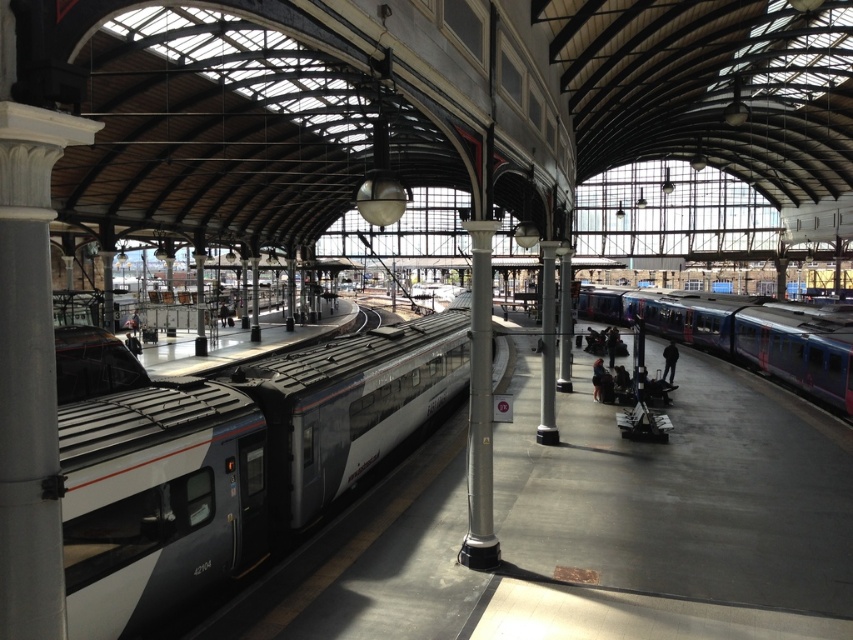
Does metallic blue train at right appear on the left side of dark blue jacket at center?

Incorrect, metallic blue train at right is not on the left side of dark blue jacket at center.

Which is in front, point (805, 353) or point (602, 376)?

Point (602, 376) is in front.

The height and width of the screenshot is (640, 853). What do you see at coordinates (747, 336) in the screenshot?
I see `metallic blue train at right` at bounding box center [747, 336].

What are the coordinates of `metallic blue train at right` in the screenshot? It's located at (747, 336).

Is silver metallic train at left thinner than dark blue jeans at center?

In fact, silver metallic train at left might be wider than dark blue jeans at center.

Can you confirm if silver metallic train at left is taller than dark blue jeans at center?

Yes.

Between point (102, 586) and point (672, 374), which one is positioned behind?

The point (672, 374) is behind.

Find the location of a particular element. This screenshot has width=853, height=640. silver metallic train at left is located at coordinates (233, 464).

Between silver metallic train at left and dark blue jacket at center, which one has less height?

Standing shorter between the two is dark blue jacket at center.

Can you confirm if silver metallic train at left is positioned to the left of dark blue jacket at center?

Correct, you'll find silver metallic train at left to the left of dark blue jacket at center.

I want to click on silver metallic train at left, so click(x=233, y=464).

Where is `silver metallic train at left`? silver metallic train at left is located at coordinates (233, 464).